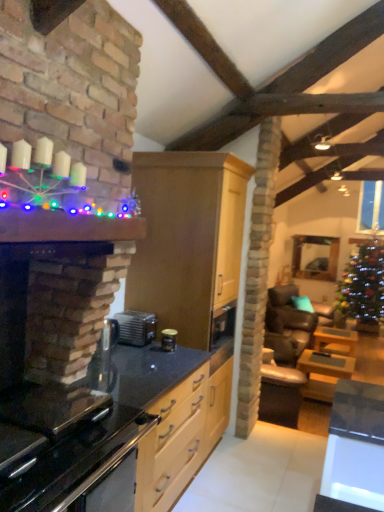
Question: Considering the positions of point (137, 316) and point (96, 425), is point (137, 316) closer or farther from the camera than point (96, 425)?

Choices:
 (A) farther
 (B) closer

Answer: (A)

Question: Relative to black glass oven at lower left, is satin silver toaster at center, arranged as the second appliance when viewed from the right, in front or behind?

Choices:
 (A) front
 (B) behind

Answer: (B)

Question: Considering the real-world distances, which object is closest to the metallic canister at center, the 1th appliance positioned from the right?

Choices:
 (A) black glass oven at lower left
 (B) green glittering christmas tree at right
 (C) black granite countertop at center
 (D) clear glass door at upper right
 (E) wooden table at right, which appears as the third table when viewed from the right

Answer: (C)

Question: Which object is the farthest from the dark brown leather armchair at center-right?

Choices:
 (A) green glittering christmas tree at right
 (B) black glass oven at lower left
 (C) satin silver toaster at center, arranged as the second appliance when viewed from the right
 (D) wooden table at right, marked as the 3th table in a back-to-front arrangement
 (E) metallic canister at center, the 1th appliance positioned from the right

Answer: (B)